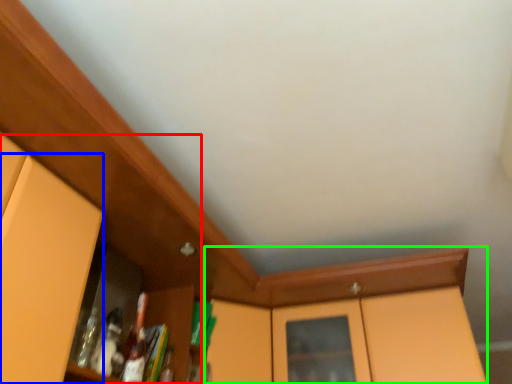
Question: Based on their relative distances, which object is nearer to dresser (highlighted by a red box)? Choose from door (highlighted by a blue box) and cabinetry (highlighted by a green box).

Choices:
 (A) door
 (B) cabinetry

Answer: (A)